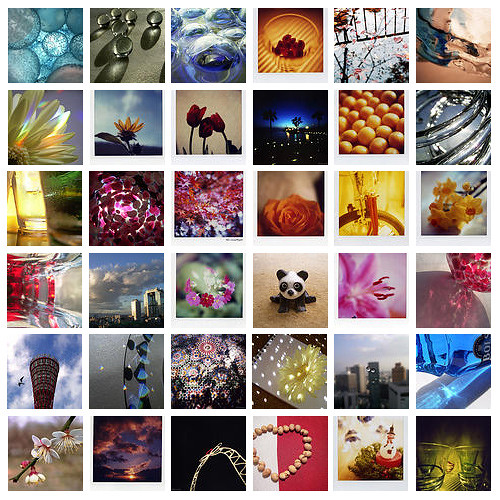
This screenshot has width=500, height=500. Identify the location of boxes in 2nd row from bottom. (441, 379), (355, 370), (275, 373), (200, 362), (129, 358), (56, 366).